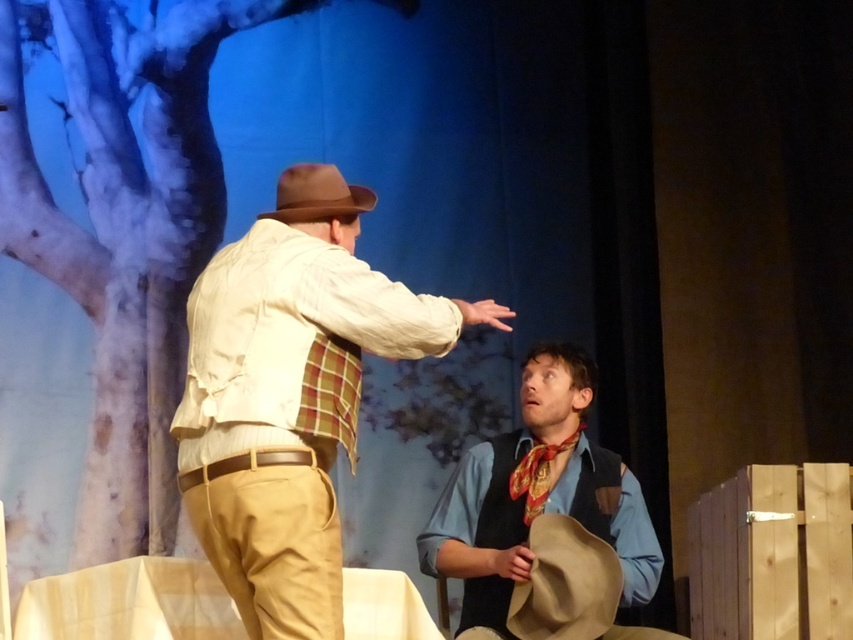
Question: Is blue denim shirt at center above brown felt cowboy hat at upper center?

Choices:
 (A) no
 (B) yes

Answer: (A)

Question: Which object appears farthest from the camera in this image?

Choices:
 (A) red silk necktie at center
 (B) light beige cotton shirt at center

Answer: (A)

Question: Which object is farther from the camera taking this photo?

Choices:
 (A) brown felt cowboy hat at lower center
 (B) brown felt cowboy hat at upper center
 (C) light beige cotton shirt at center
 (D) blue denim shirt at center

Answer: (D)

Question: Among these points, which one is farthest from the camera?

Choices:
 (A) (589, 556)
 (B) (381, 339)
 (C) (314, 188)

Answer: (A)

Question: In this image, where is brown felt cowboy hat at lower center located relative to red silk necktie at center?

Choices:
 (A) above
 (B) below

Answer: (B)

Question: Where is brown felt cowboy hat at upper center located in relation to red silk necktie at center in the image?

Choices:
 (A) above
 (B) below

Answer: (A)